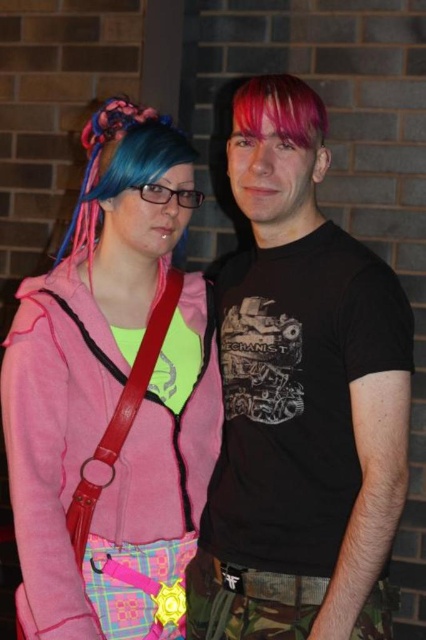
You are a photographer trying to capture a portrait of both individuals. Since you want to ensure both subjects are framed properly, which direction should you move your camera to focus on the person with blue dyed hair at center first before the pink matte hair at center?

Since the blue dyed hair at center is to the left of pink matte hair at center, you should move your camera to the left to focus on the blue dyed hair at center first before shifting to the pink matte hair at center.

Consider the image. You are a photographer adjusting your camera settings to focus on two specific points in the image. The points are labeled as point 1 at coordinates point (235, 518) and point 2 at coordinates point (118, 104). Which point should you focus on first to ensure the closest object is sharp?

Point 1 at coordinates point (235, 518) should be focused on first because it is closer to the camera than point 2 at coordinates point (118, 104).